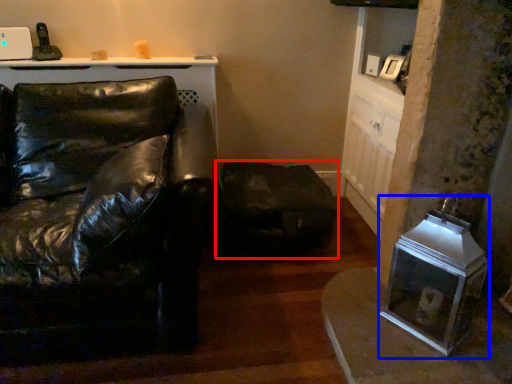
Question: Which object appears farthest to the camera in this image, swivel chair (highlighted by a red box) or appliance (highlighted by a blue box)?

Choices:
 (A) swivel chair
 (B) appliance

Answer: (A)